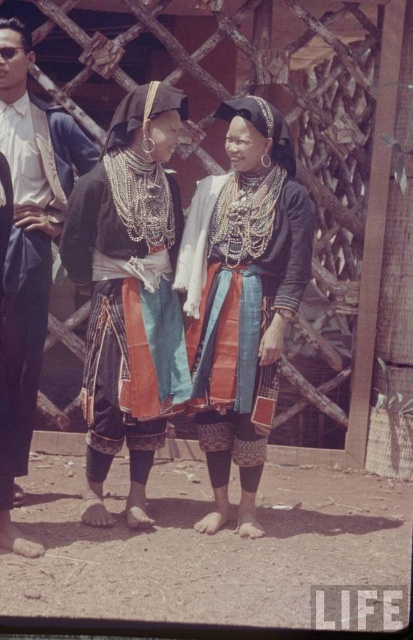
You are a photographer positioned in front of the wooden lattice structure and want to capture both the matte black dress at center and the textured blue skirt at center in a single shot. Which of the two items will appear closer to you in the photo?

The matte black dress at center will appear closer to you in the photo because it is positioned further to the viewer than the textured blue skirt at center.